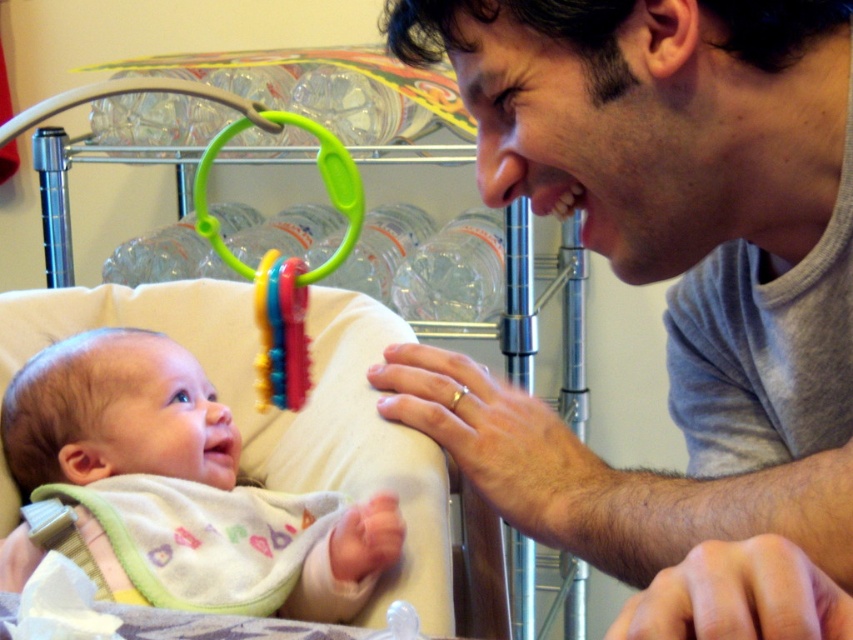
Question: Which of these objects is positioned farthest from the rubberized plastic teething ring at upper center?

Choices:
 (A) rubber teething ring at lower center
 (B) gray cotton shirt at upper right

Answer: (B)

Question: Is soft white bib at center above rubberized plastic teething ring at upper center?

Choices:
 (A) no
 (B) yes

Answer: (A)

Question: Which point is closer to the camera?

Choices:
 (A) gray cotton shirt at upper right
 (B) soft white bib at center

Answer: (A)

Question: Which of the following is the farthest from the observer?

Choices:
 (A) (260, 595)
 (B) (306, 289)

Answer: (A)

Question: Where is gray cotton shirt at upper right located in relation to rubberized plastic teething ring at upper center in the image?

Choices:
 (A) below
 (B) above

Answer: (B)

Question: Can you confirm if gray cotton shirt at upper right is positioned to the right of rubberized plastic teething ring at upper center?

Choices:
 (A) no
 (B) yes

Answer: (B)